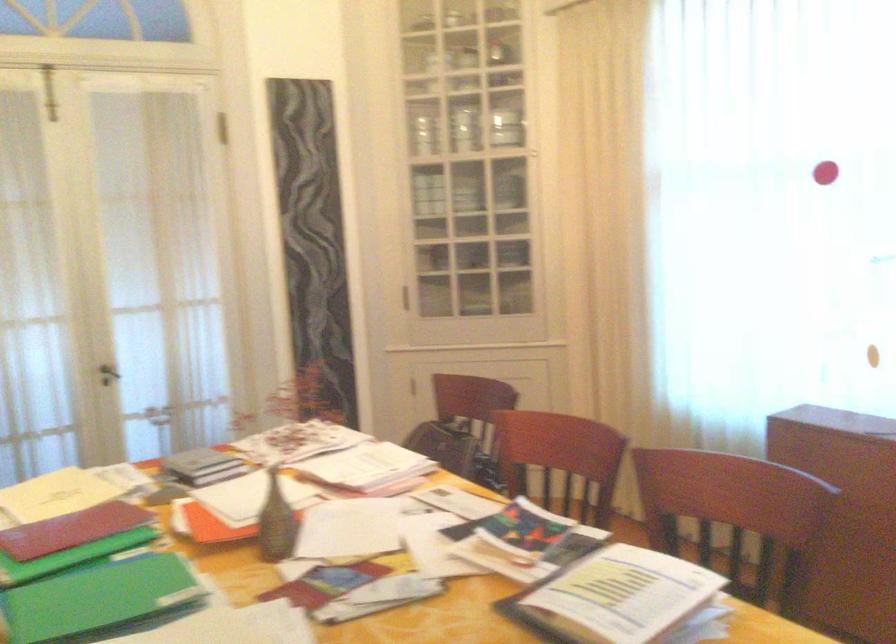
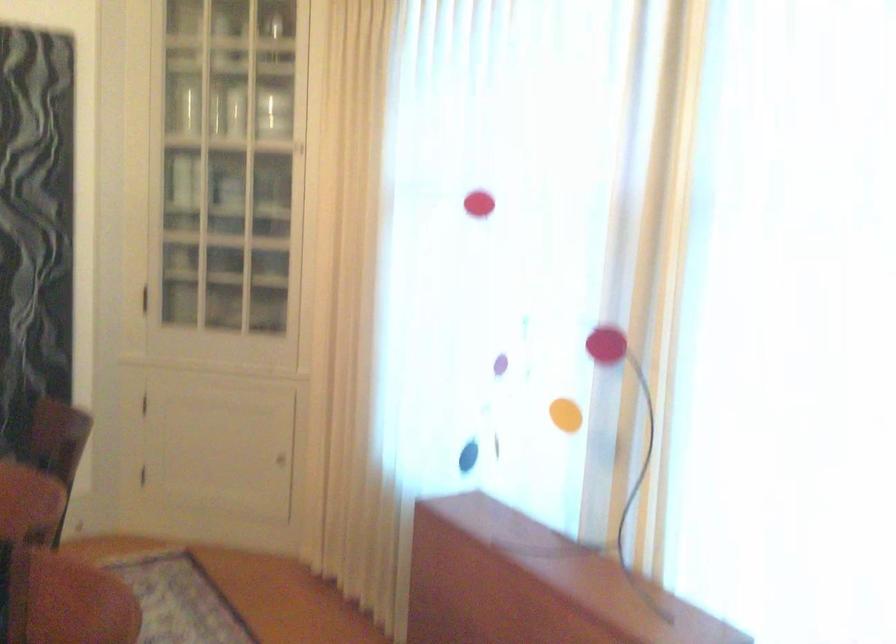
In the scene shown: Which direction would the cameraman need to move to produce the second image?

The cameraman moved toward right, forward.